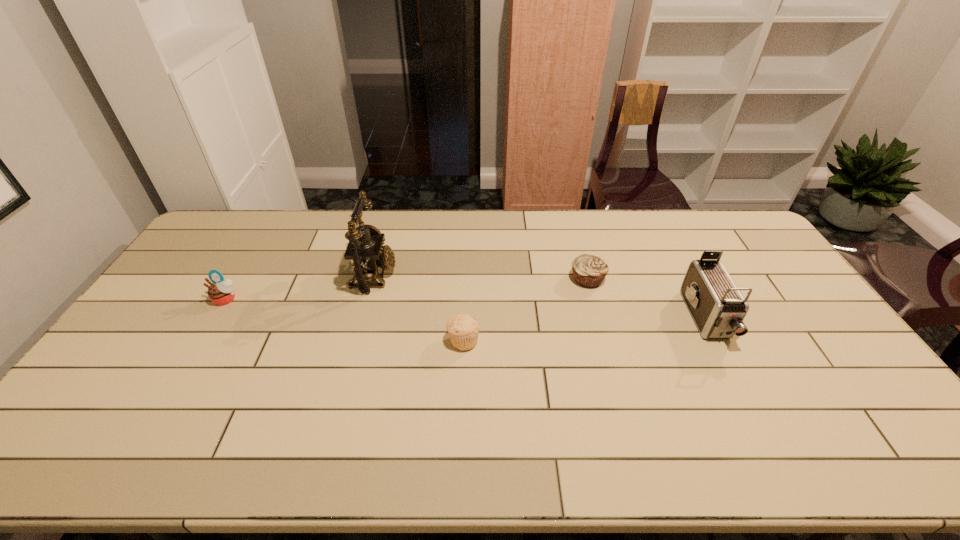
Find the location of a particular element. vacant area situated on the rotary dial of the fourth object from right to left is located at coordinates (489, 275).

This screenshot has width=960, height=540. In order to click on free space located at the lens of the camcorder in this screenshot , I will do `click(735, 376)`.

I want to click on free space located on the front-facing side of the second nearest muffin, so click(x=214, y=319).

Find the location of a particular element. Image resolution: width=960 pixels, height=540 pixels. vacant space located on the back of the second object from right to left is located at coordinates (570, 216).

At what (x,y) coordinates should I click in order to perform the action: click on vacant region located on the front of the second muffin from left to right. Please return your answer as a coordinate pair (x, y). The width and height of the screenshot is (960, 540). Looking at the image, I should click on (460, 445).

Image resolution: width=960 pixels, height=540 pixels. I want to click on free space at the far edge of the desktop, so click(449, 216).

Locate an element on the screen. This screenshot has height=540, width=960. vacant space at the near edge of the desktop is located at coordinates (563, 458).

Locate an element on the screen. Image resolution: width=960 pixels, height=540 pixels. free space at the left edge is located at coordinates (171, 292).

In the image, there is a desktop. Find the location of `vacant space at the right edge`. vacant space at the right edge is located at coordinates (843, 354).

Where is `vacant space at the far left corner of the desktop`? vacant space at the far left corner of the desktop is located at coordinates (228, 230).